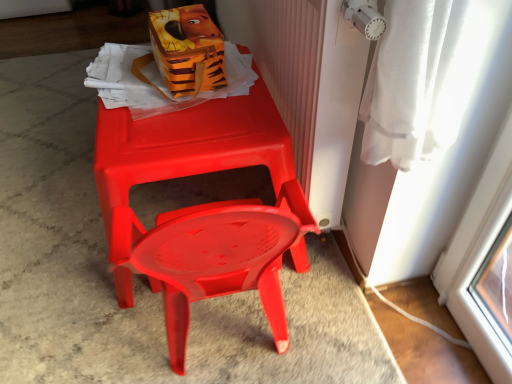
Question: Is the depth of matte plastic chair at center less than that of white textured radiator at upper right?

Choices:
 (A) no
 (B) yes

Answer: (A)

Question: Can you confirm if matte plastic chair at center is positioned to the left of white textured radiator at upper right?

Choices:
 (A) yes
 (B) no

Answer: (A)

Question: Does matte plastic chair at center have a lesser height compared to white textured radiator at upper right?

Choices:
 (A) yes
 (B) no

Answer: (A)

Question: From the image's perspective, is matte plastic chair at center below white textured radiator at upper right?

Choices:
 (A) yes
 (B) no

Answer: (A)

Question: From a real-world perspective, is matte plastic chair at center positioned under white textured radiator at upper right based on gravity?

Choices:
 (A) no
 (B) yes

Answer: (B)

Question: From a real-world perspective, is orange fabric lunch box at upper center positioned above or below white textured radiator at upper right?

Choices:
 (A) above
 (B) below

Answer: (A)

Question: Looking at the image, does orange fabric lunch box at upper center seem bigger or smaller compared to white textured radiator at upper right?

Choices:
 (A) big
 (B) small

Answer: (B)

Question: Looking at their shapes, would you say orange fabric lunch box at upper center is wider or thinner than white textured radiator at upper right?

Choices:
 (A) thin
 (B) wide

Answer: (B)

Question: Does point (202, 18) appear closer or farther from the camera than point (308, 8)?

Choices:
 (A) closer
 (B) farther

Answer: (B)

Question: From the image's perspective, is matte plastic chair at center above or below white textured radiator at upper right?

Choices:
 (A) below
 (B) above

Answer: (A)

Question: Is point (120, 251) positioned closer to the camera than point (293, 54)?

Choices:
 (A) closer
 (B) farther

Answer: (A)

Question: Looking at their shapes, would you say matte plastic chair at center is wider or thinner than white textured radiator at upper right?

Choices:
 (A) wide
 (B) thin

Answer: (A)

Question: From a real-world perspective, relative to white textured radiator at upper right, is matte plastic chair at center vertically above or below?

Choices:
 (A) below
 (B) above

Answer: (A)

Question: Would you say orange fabric lunch box at upper center is to the left or to the right of matte plastic chair at center in the picture?

Choices:
 (A) right
 (B) left

Answer: (B)

Question: From the image's perspective, is orange fabric lunch box at upper center above or below matte plastic chair at center?

Choices:
 (A) above
 (B) below

Answer: (A)